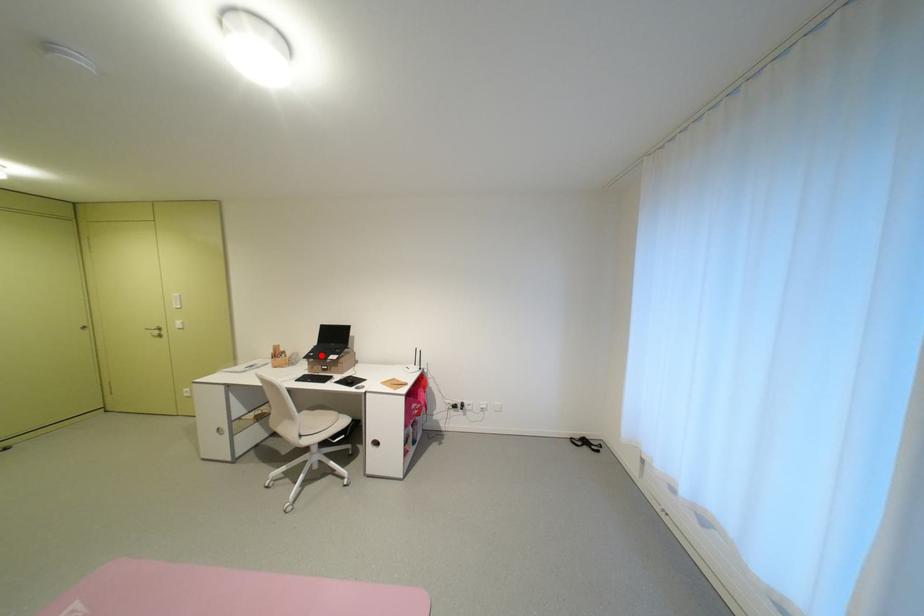
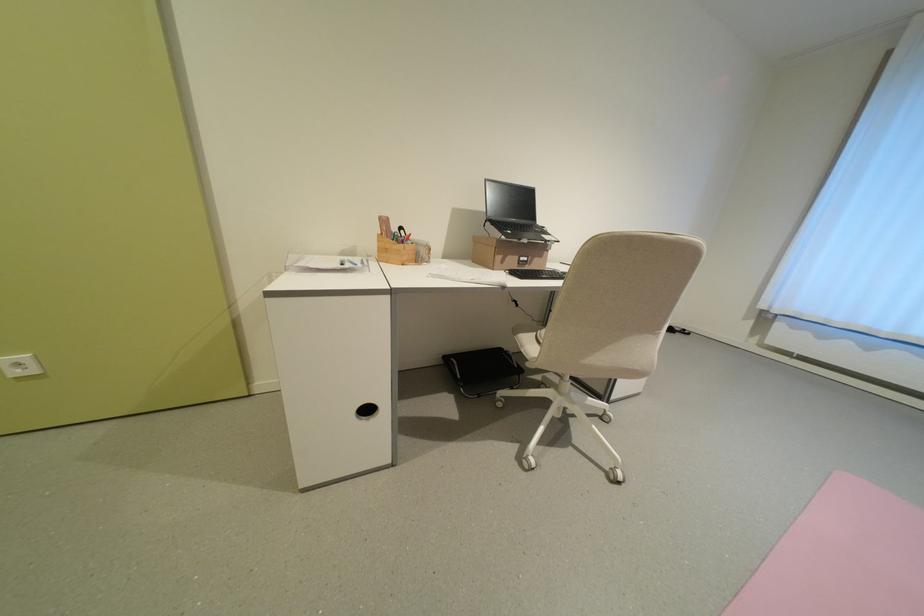
Question: I am providing you with two images of the same scene from different viewpoints. A red point is marked on the first image. Is the red point's position out of view in image 2?

Choices:
 (A) Yes
 (B) No

Answer: (B)